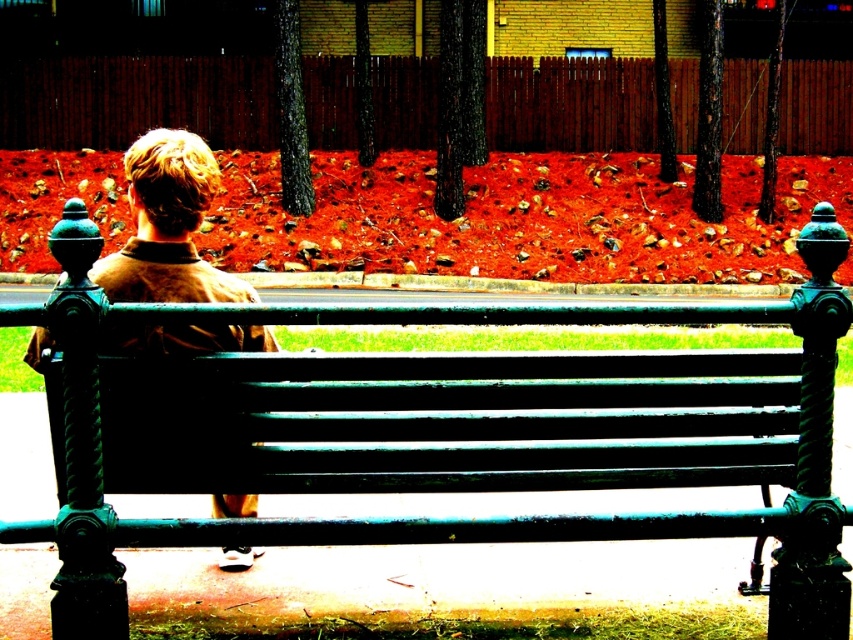
The width and height of the screenshot is (853, 640). In order to click on green painted wood bench at center in this screenshot , I will do `click(431, 433)`.

Does green painted wood bench at center have a smaller size compared to brown woolen jacket at center?

No, green painted wood bench at center is not smaller than brown woolen jacket at center.

Does point (627, 323) lie behind point (143, 228)?

No, (627, 323) is in front of (143, 228).

This screenshot has width=853, height=640. In order to click on green painted wood bench at center in this screenshot , I will do `click(431, 433)`.